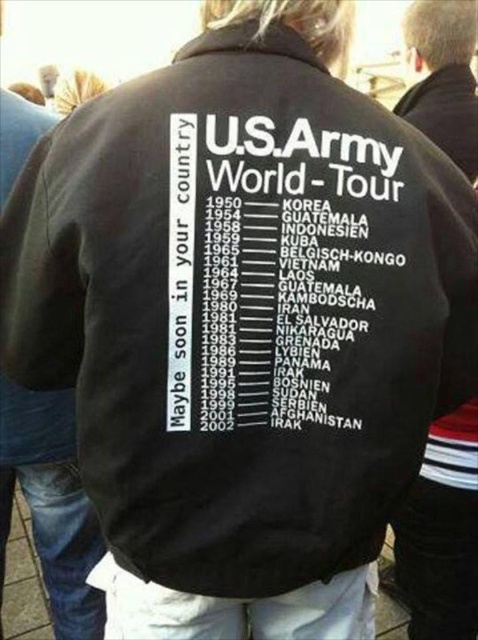
You are a tailor measuring a black fabric jacket at upper center and a black fabric text at center for alterations. Which one is located lower?

The black fabric text at center is positioned under black fabric jacket at upper center, so the black fabric text at center is lower.

You are designing a new military jacket and want to ensure the text is visible from a distance. Given the current design where the black fabric text at center is smaller than the black fabric jacket at upper center, would the text be easy to read from across the room?

The black fabric text at center is smaller than the black fabric jacket at upper center, so it might be difficult to read from a distance. To improve visibility, consider enlarging the text or using a contrasting color.